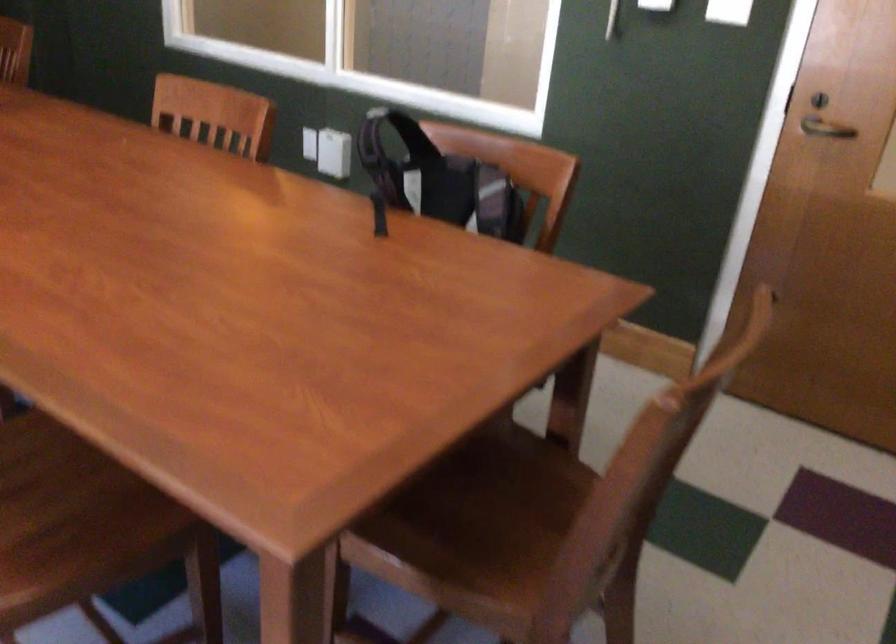
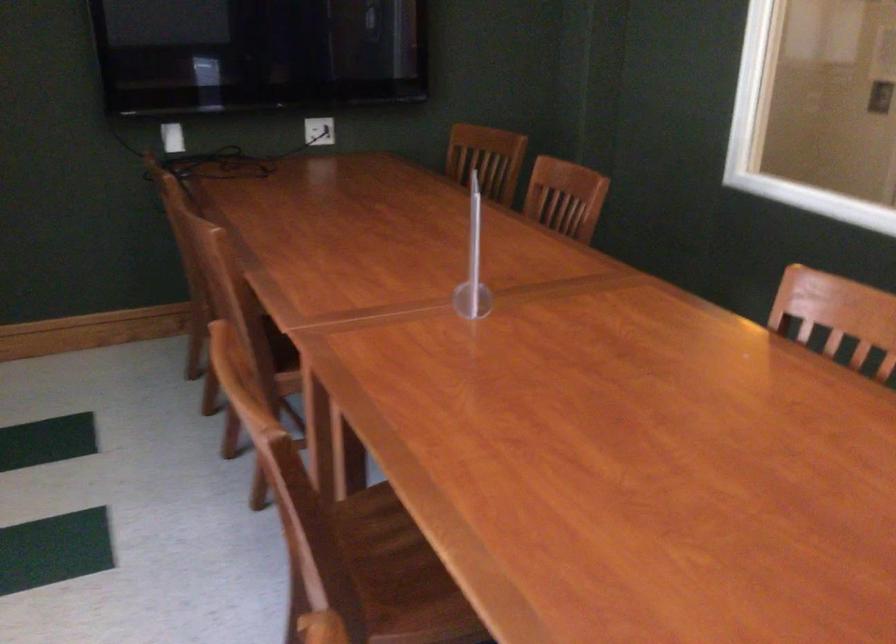
Question: The camera is either moving clockwise (left) or counter-clockwise (right) around the object. The first image is from the beginning of the video and the second image is from the end. Is the camera moving left or right when shooting the video?

Choices:
 (A) Left
 (B) Right

Answer: (B)